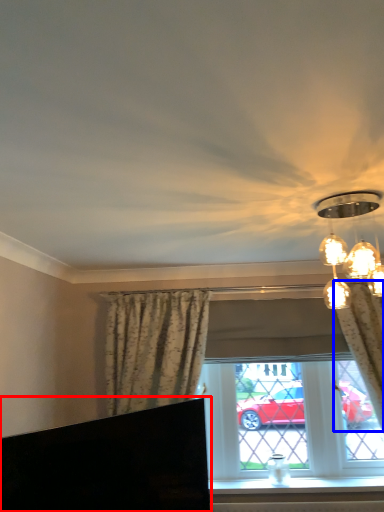
Question: Among these objects, which one is nearest to the camera, furniture (highlighted by a red box) or curtain (highlighted by a blue box)?

Choices:
 (A) furniture
 (B) curtain

Answer: (A)